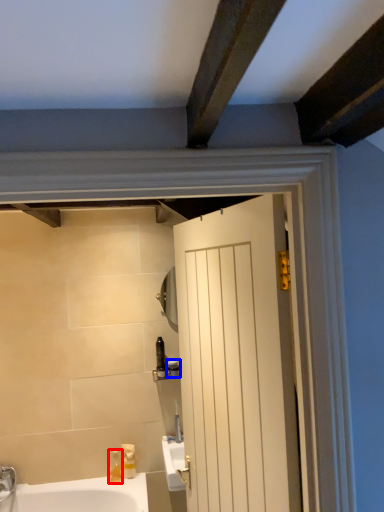
Question: Which point is closer to the camera, soap dispenser (highlighted by a red box) or toiletry (highlighted by a blue box)?

Choices:
 (A) soap dispenser
 (B) toiletry

Answer: (A)